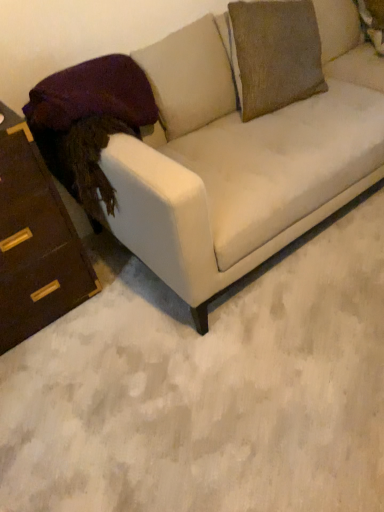
Where is `free space between brown wood chest of drawers at left and matte white couch at center`? free space between brown wood chest of drawers at left and matte white couch at center is located at coordinates (104, 333).